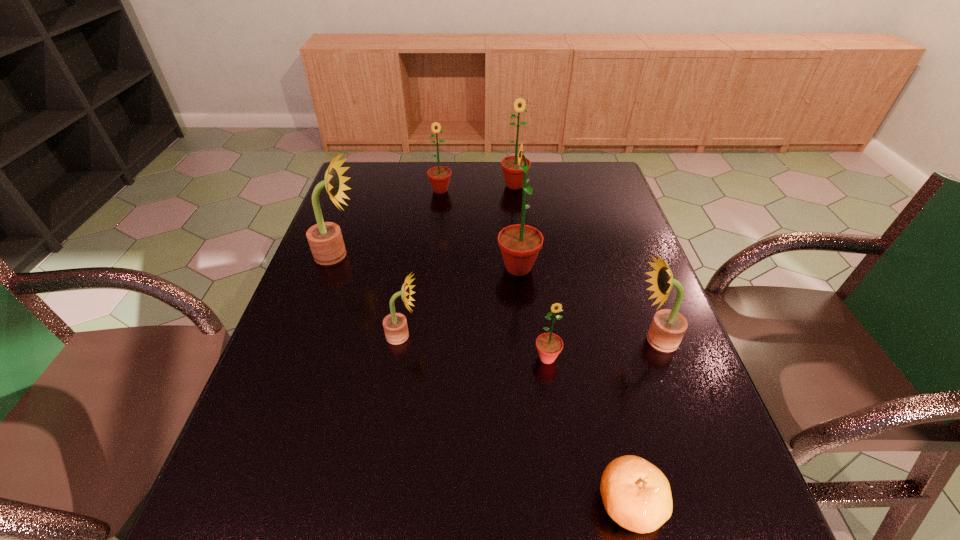
Where is `free space located 0.280m on the face of the nearest green sunflower`? free space located 0.280m on the face of the nearest green sunflower is located at coordinates (567, 507).

Find the location of a particular element. The image size is (960, 540). object situated at the left edge is located at coordinates (325, 239).

You are a GUI agent. You are given a task and a screenshot of the screen. Output one action in this format:
    pyautogui.click(x=<x>, y=<y>)
    Task: Click on the object that is at the right edge
    The width and height of the screenshot is (960, 540).
    Given the screenshot: What is the action you would take?
    pyautogui.click(x=668, y=327)

The image size is (960, 540). I want to click on free space at the far edge of the desktop, so click(483, 167).

Identify the location of free space at the near edge. (479, 515).

The image size is (960, 540). In the image, there is a desktop. Find the location of `free space at the left edge`. free space at the left edge is located at coordinates (308, 462).

Where is `vacant position at the right edge of the desktop`? vacant position at the right edge of the desktop is located at coordinates (613, 213).

At what (x,y) coordinates should I click in order to perform the action: click on free region at the far left corner. Please return your answer as a coordinate pair (x, y). The width and height of the screenshot is (960, 540). Looking at the image, I should click on (363, 165).

At what (x,y) coordinates should I click in order to perform the action: click on vacant space at the far right corner of the desktop. Please return your answer as a coordinate pair (x, y). Looking at the image, I should click on (588, 189).

Image resolution: width=960 pixels, height=540 pixels. Find the location of `vacant area that lies between the tallest sunflower and the leftmost yellow sunflower`. vacant area that lies between the tallest sunflower and the leftmost yellow sunflower is located at coordinates (428, 261).